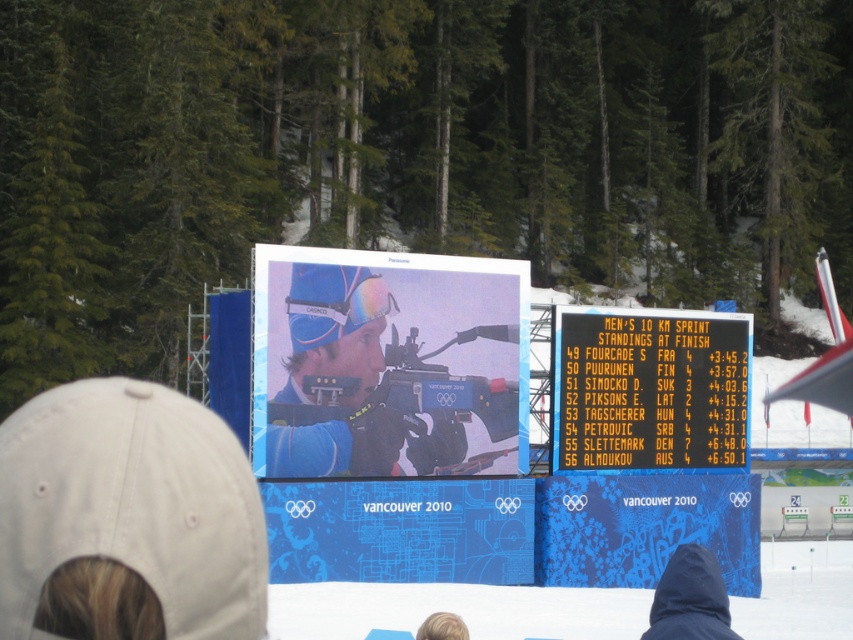
Question: Where is white fabric baseball cap at lower left located in relation to blue matte rifle at center in the image?

Choices:
 (A) above
 (B) below

Answer: (B)

Question: Which object is positioned farthest from the black plastic scoreboard at center?

Choices:
 (A) white fabric baseball cap at lower left
 (B) blue matte rifle at center

Answer: (A)

Question: Considering the real-world distances, which object is farthest from the blue matte rifle at center?

Choices:
 (A) white fabric baseball cap at lower left
 (B) black plastic scoreboard at center

Answer: (A)

Question: Which point is farther to the camera?

Choices:
 (A) (412, 448)
 (B) (51, 534)

Answer: (A)

Question: Does white fabric baseball cap at lower left appear under black plastic scoreboard at center?

Choices:
 (A) yes
 (B) no

Answer: (A)

Question: Can you confirm if blue matte rifle at center is smaller than black plastic scoreboard at center?

Choices:
 (A) yes
 (B) no

Answer: (B)